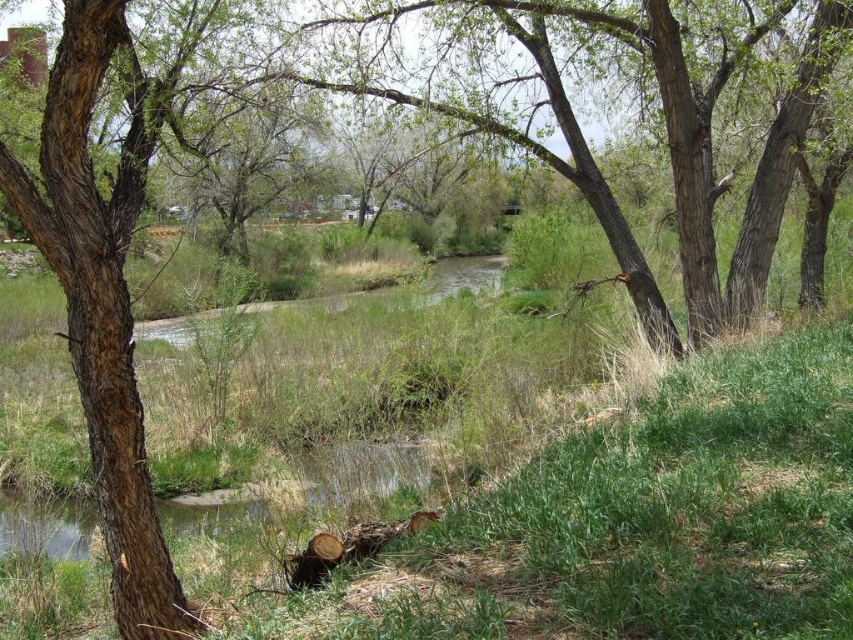
You are standing at the point indicated by point (102,301) in the image, which is located at the brown rough bark tree trunk at left. You want to walk towards the stream in the center. Which direction should you head?

Since the point (102,301) is at the brown rough bark tree trunk at left, and the stream is centrally located, you should head towards the center of the image to reach the stream.